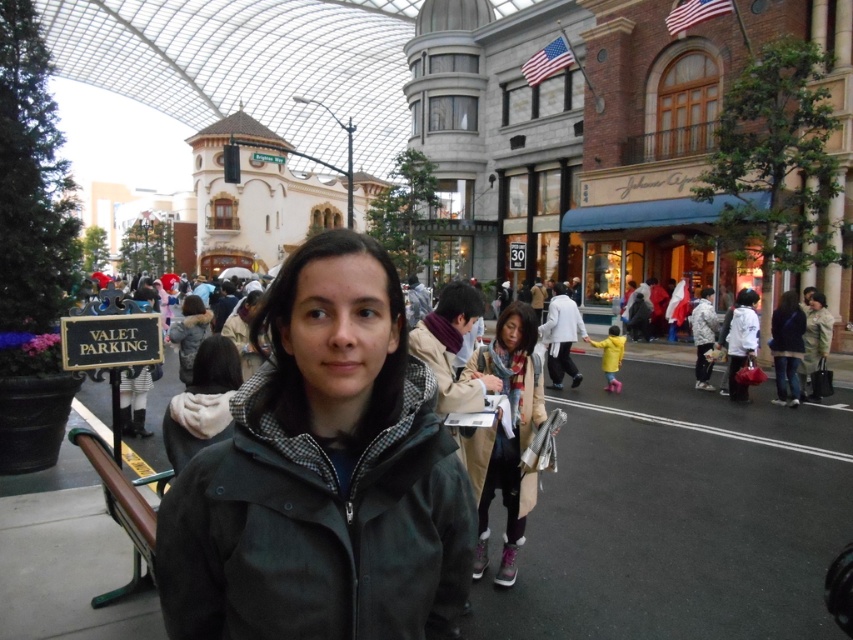
Which is behind, point (508, 458) or point (187, 310)?

The point (187, 310) is more distant.

Is point (527, 400) positioned in front of point (172, 330)?

Yes, point (527, 400) is closer to viewer.

Where is `beige wool scarf at center`? beige wool scarf at center is located at coordinates (505, 435).

Who is higher up, beige wool scarf at center or light brown fur coat at center?

Positioned higher is beige wool scarf at center.

Can you confirm if beige wool scarf at center is positioned above light brown fur coat at center?

Yes, beige wool scarf at center is above light brown fur coat at center.

Is point (502, 349) positioned before point (218, 378)?

No, (502, 349) is further to viewer.

Identify the location of beige wool scarf at center. (505, 435).

Does dark green textured jacket at center appear on the left side of beige wool scarf at center?

Indeed, dark green textured jacket at center is positioned on the left side of beige wool scarf at center.

Is point (440, 428) less distant than point (518, 387)?

Yes, point (440, 428) is in front of point (518, 387).

Describe the element at coordinates (318, 529) in the screenshot. This screenshot has width=853, height=640. I see `dark green textured jacket at center` at that location.

What are the coordinates of `dark green textured jacket at center` in the screenshot? It's located at (318, 529).